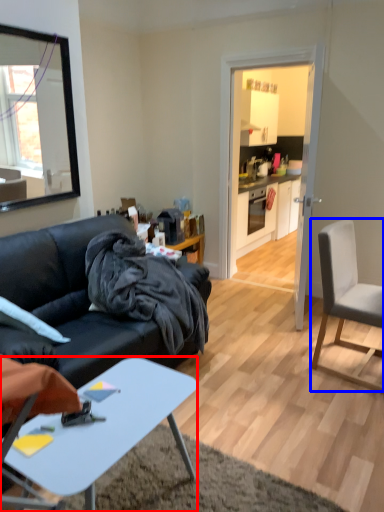
Question: Which point is further to the camera, desk (highlighted by a red box) or chair (highlighted by a blue box)?

Choices:
 (A) desk
 (B) chair

Answer: (B)